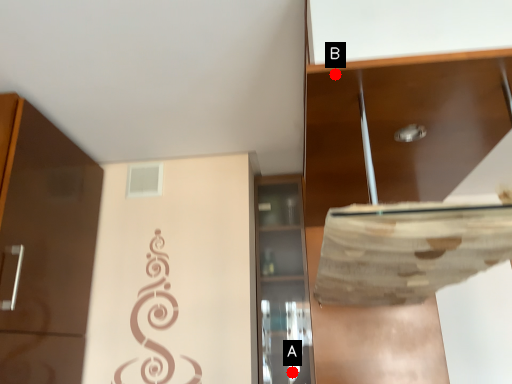
Question: Two points are circled on the image, labeled by A and B beside each circle. Which point is closer to the camera?

Choices:
 (A) A is closer
 (B) B is closer

Answer: (B)